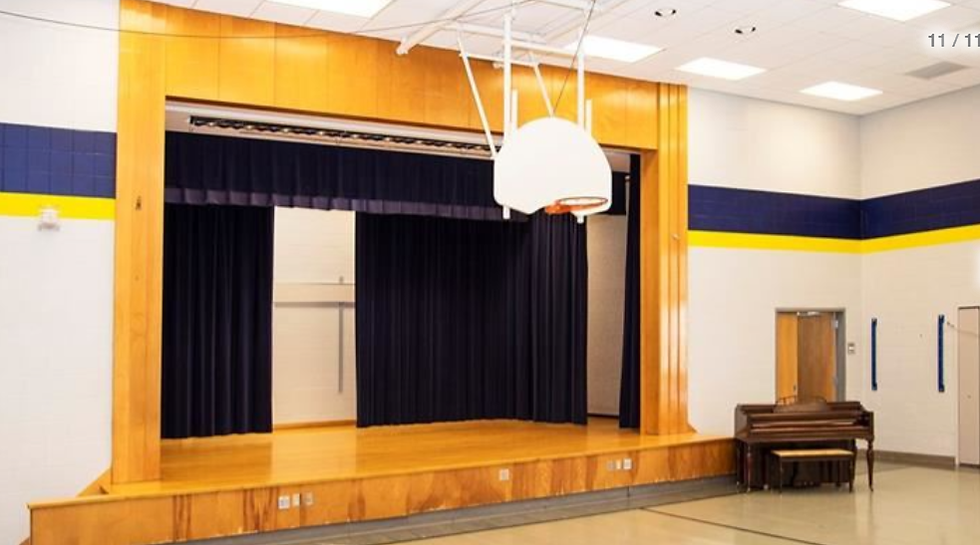
I want to click on curtains, so click(323, 183), click(183, 310), click(430, 308).